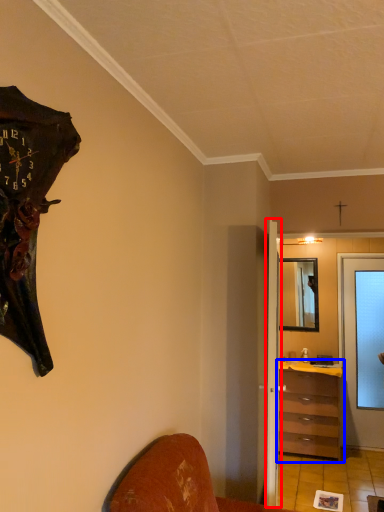
Question: Which point is closer to the camera, door (highlighted by a red box) or chest of drawers (highlighted by a blue box)?

Choices:
 (A) door
 (B) chest of drawers

Answer: (A)